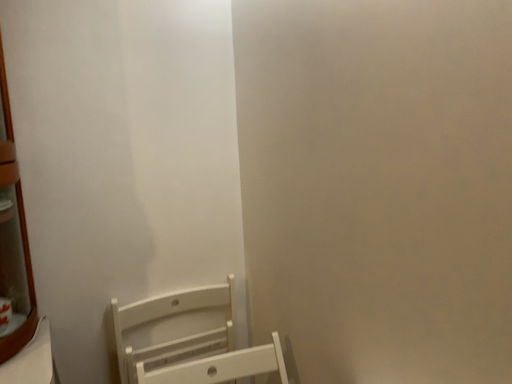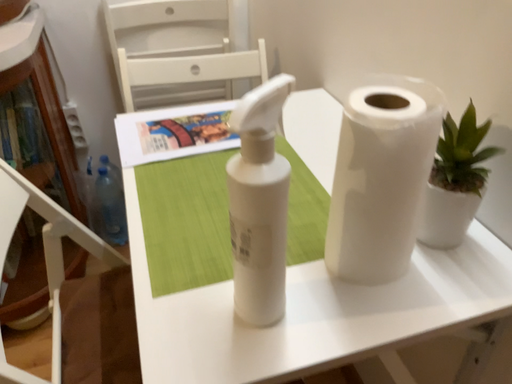
Question: How did the camera likely rotate when shooting the video?

Choices:
 (A) rotated right
 (B) rotated left

Answer: (B)